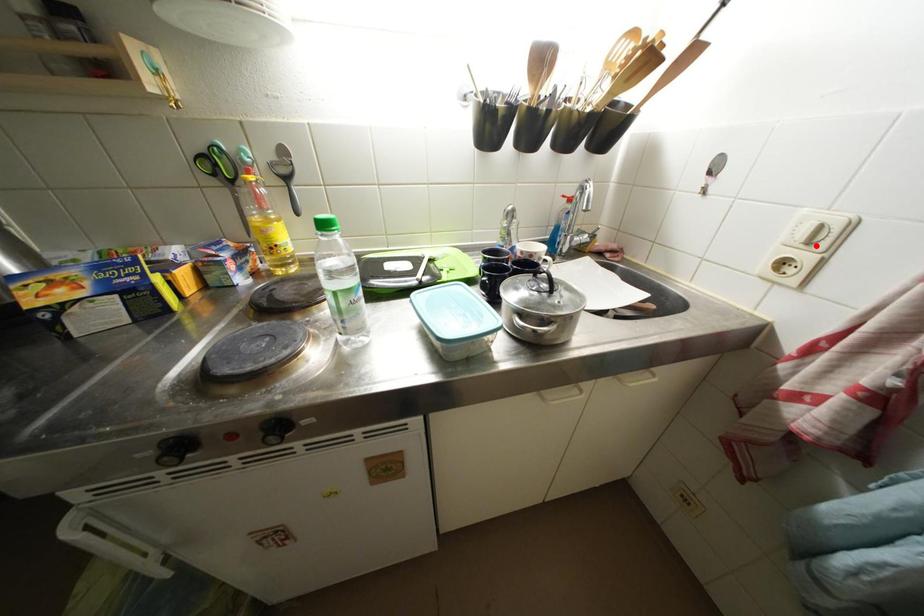
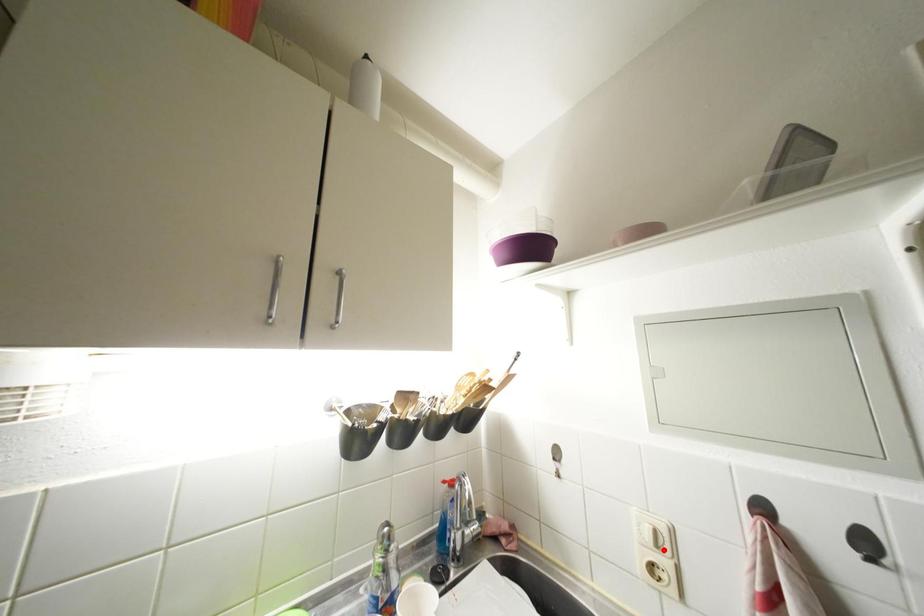
Consider the image. I am providing you with two images of the same scene from different viewpoints. A red point is marked on the first image and another point is marked on the second image. Are the points marked in image1 and image2 representing the same 3D position?

Yes